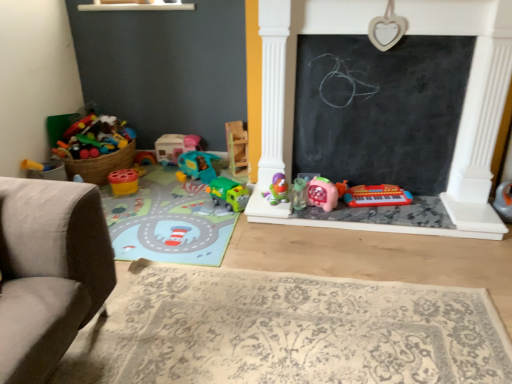
Question: Considering the relative sizes of matte plastic toy at center, acting as the fifth toy starting from the right, and white plastic toy at right, which is the 1th toy from right to left, in the image provided, is matte plastic toy at center, acting as the fifth toy starting from the right, taller than white plastic toy at right, which is the 1th toy from right to left,?

Choices:
 (A) no
 (B) yes

Answer: (A)

Question: Is white plastic toy at right, marked as the 10th toy in a left-to-right arrangement, surrounded by matte plastic toy at center, which is the 6th toy from left to right?

Choices:
 (A) no
 (B) yes

Answer: (A)

Question: Is matte plastic toy at center, acting as the fifth toy starting from the right, outside of white plastic toy at right, marked as the 10th toy in a left-to-right arrangement?

Choices:
 (A) yes
 (B) no

Answer: (A)

Question: From a real-world perspective, is matte plastic toy at center, acting as the fifth toy starting from the right, positioned under white plastic toy at right, which is the 1th toy from right to left, based on gravity?

Choices:
 (A) no
 (B) yes

Answer: (A)

Question: Is matte plastic toy at center, which is the 6th toy from left to right, bigger than white plastic toy at right, which is the 1th toy from right to left?

Choices:
 (A) yes
 (B) no

Answer: (B)

Question: Is matte plastic toy at center, acting as the fifth toy starting from the right, shorter than white plastic toy at right, which is the 1th toy from right to left?

Choices:
 (A) yes
 (B) no

Answer: (A)

Question: From the image's perspective, is teal plastic toy car at center, which appears as the 3th toy when viewed from the left, on top of clear plastic sippy cup at center, which ranks as the 7th toy in left-to-right order?

Choices:
 (A) no
 (B) yes

Answer: (B)

Question: Can you confirm if teal plastic toy car at center, which appears as the 3th toy when viewed from the left, is thinner than clear plastic sippy cup at center, which ranks as the 7th toy in left-to-right order?

Choices:
 (A) yes
 (B) no

Answer: (B)

Question: Can you confirm if teal plastic toy car at center, which appears as the 3th toy when viewed from the left, is wider than clear plastic sippy cup at center, the fourth toy when ordered from right to left?

Choices:
 (A) no
 (B) yes

Answer: (B)

Question: Is teal plastic toy car at center, the eighth toy viewed from the right, surrounding clear plastic sippy cup at center, which ranks as the 7th toy in left-to-right order?

Choices:
 (A) yes
 (B) no

Answer: (B)

Question: Is teal plastic toy car at center, the eighth toy viewed from the right, completely or partially outside of clear plastic sippy cup at center, the fourth toy when ordered from right to left?

Choices:
 (A) yes
 (B) no

Answer: (A)

Question: Is teal plastic toy car at center, the eighth toy viewed from the right, to the right of clear plastic sippy cup at center, the fourth toy when ordered from right to left, from the viewer's perspective?

Choices:
 (A) no
 (B) yes

Answer: (A)

Question: Can you confirm if green plastic truck at center, the seventh toy viewed from the right, is positioned to the right of matte plastic toy car at center, the 9th toy when ordered from right to left?

Choices:
 (A) yes
 (B) no

Answer: (A)